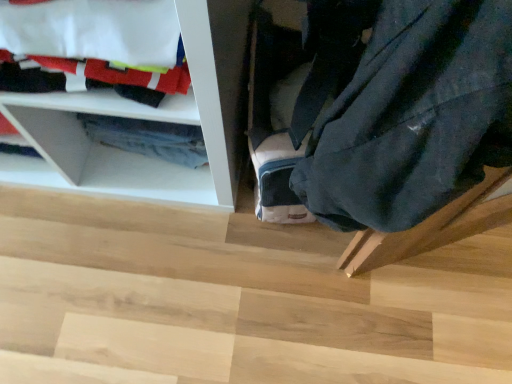
Question: Is dark blue fabric at lower right smaller than wooden step at lower right?

Choices:
 (A) no
 (B) yes

Answer: (B)

Question: Considering the relative positions of dark blue fabric at lower right and wooden step at lower right in the image provided, is dark blue fabric at lower right to the left of wooden step at lower right from the viewer's perspective?

Choices:
 (A) yes
 (B) no

Answer: (B)

Question: Does dark blue fabric at lower right have a greater width compared to wooden step at lower right?

Choices:
 (A) yes
 (B) no

Answer: (B)

Question: Is dark blue fabric at lower right further to camera compared to wooden step at lower right?

Choices:
 (A) no
 (B) yes

Answer: (A)

Question: Is dark blue fabric at lower right positioned with its back to wooden step at lower right?

Choices:
 (A) no
 (B) yes

Answer: (A)

Question: From a real-world perspective, is dark blue fabric at lower right over wooden step at lower right?

Choices:
 (A) no
 (B) yes

Answer: (B)

Question: Is white fabric at upper left with dark blue fabric at lower right?

Choices:
 (A) no
 (B) yes

Answer: (A)

Question: Is white fabric at upper left taller than dark blue fabric at lower right?

Choices:
 (A) yes
 (B) no

Answer: (B)

Question: Could you tell me if white fabric at upper left is facing dark blue fabric at lower right?

Choices:
 (A) no
 (B) yes

Answer: (A)

Question: Is white fabric at upper left to the left of dark blue fabric at lower right from the viewer's perspective?

Choices:
 (A) no
 (B) yes

Answer: (B)

Question: From the image's perspective, is white fabric at upper left located beneath dark blue fabric at lower right?

Choices:
 (A) no
 (B) yes

Answer: (A)

Question: Considering the relative positions of white fabric at upper left and dark blue fabric at lower right in the image provided, is white fabric at upper left in front of dark blue fabric at lower right?

Choices:
 (A) no
 (B) yes

Answer: (A)

Question: From the image's perspective, is wooden step at lower right over dark blue fabric at lower right?

Choices:
 (A) yes
 (B) no

Answer: (B)